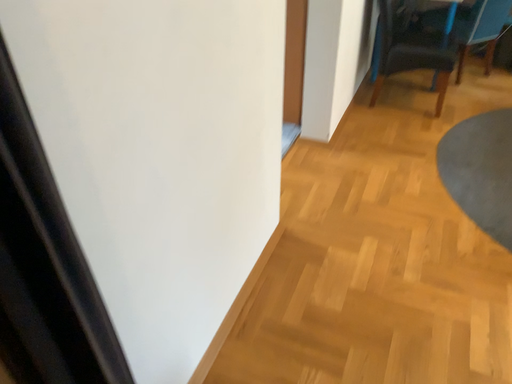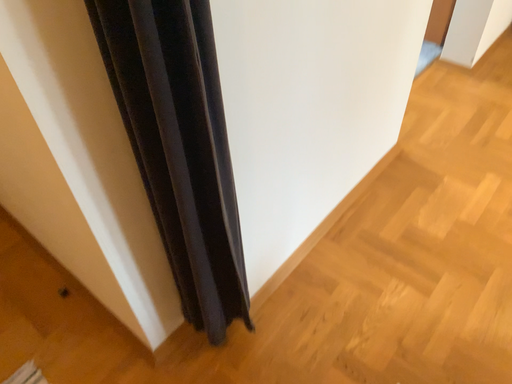
Question: How did the camera likely rotate when shooting the video?

Choices:
 (A) rotated right
 (B) rotated left

Answer: (B)